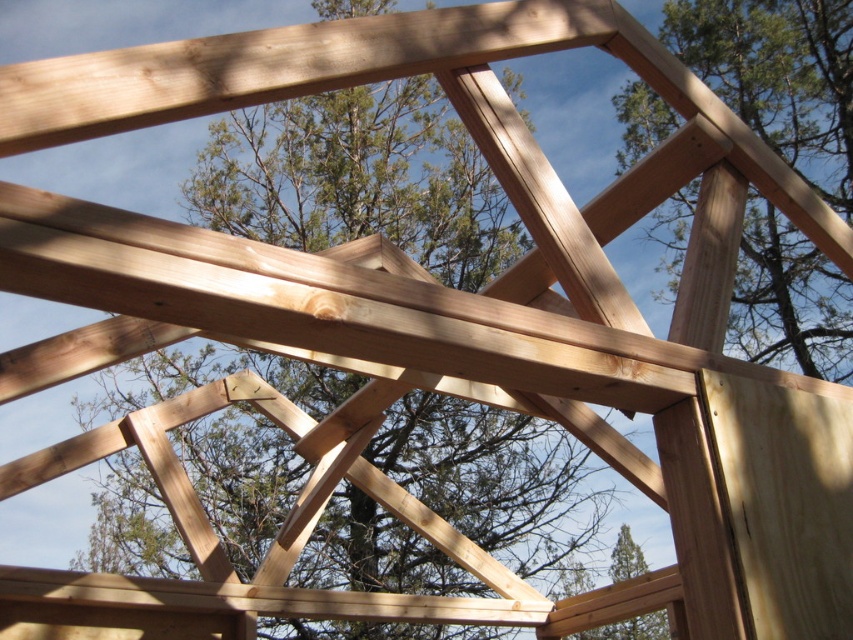
Question: Which of the following is the farthest from the observer?

Choices:
 (A) natural wood tree at center
 (B) natural wood post at upper right

Answer: (A)

Question: Does natural wood tree at center appear over natural wood post at upper right?

Choices:
 (A) yes
 (B) no

Answer: (B)

Question: Does natural wood tree at center appear on the right side of natural wood post at upper right?

Choices:
 (A) yes
 (B) no

Answer: (B)

Question: Which object appears farthest from the camera in this image?

Choices:
 (A) natural wood post at upper right
 (B) natural wood tree at center

Answer: (B)

Question: Which of the following is the closest to the observer?

Choices:
 (A) (498, 269)
 (B) (643, 106)

Answer: (A)

Question: Can you confirm if natural wood tree at center is thinner than natural wood post at upper right?

Choices:
 (A) no
 (B) yes

Answer: (B)